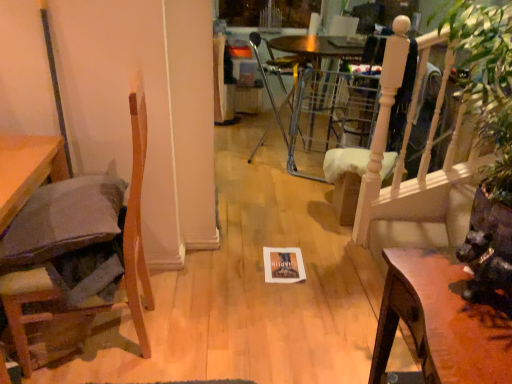
The width and height of the screenshot is (512, 384). I want to click on free space below wooden chair at left, the 2th chair from the back (from a real-world perspective), so click(126, 338).